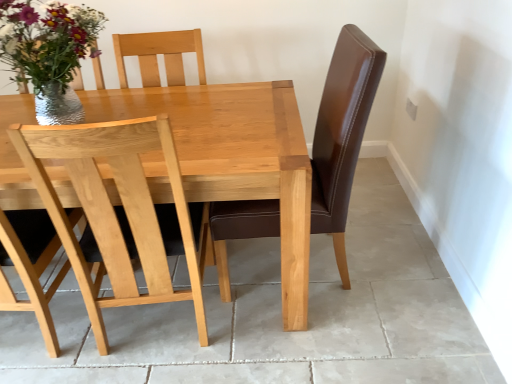
Question: Is point (160, 301) positioned closer to the camera than point (59, 89)?

Choices:
 (A) farther
 (B) closer

Answer: (B)

Question: Considering the positions of light wood chair at center and shiny metallic vase at upper left in the image, is light wood chair at center taller or shorter than shiny metallic vase at upper left?

Choices:
 (A) short
 (B) tall

Answer: (B)

Question: In the image, is light wood chair at center positioned in front of or behind shiny metallic vase at upper left?

Choices:
 (A) front
 (B) behind

Answer: (A)

Question: From the image's perspective, is shiny metallic vase at upper left located above or below light wood chair at center?

Choices:
 (A) above
 (B) below

Answer: (A)

Question: Relative to light wood chair at center, is shiny metallic vase at upper left in front or behind?

Choices:
 (A) front
 (B) behind

Answer: (B)

Question: From a real-world perspective, is shiny metallic vase at upper left positioned above or below light wood chair at center?

Choices:
 (A) below
 (B) above

Answer: (B)

Question: From their relative heights in the image, would you say shiny metallic vase at upper left is taller or shorter than light wood chair at center?

Choices:
 (A) tall
 (B) short

Answer: (B)